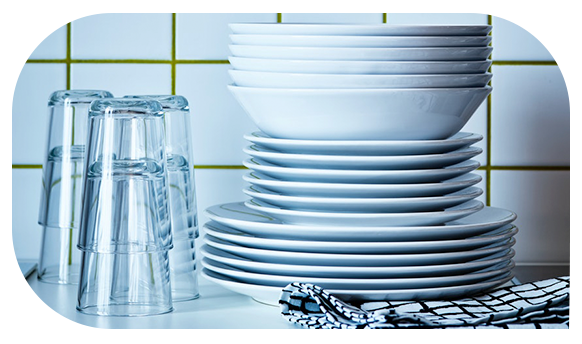
Where is `cups`? This screenshot has height=344, width=582. cups is located at coordinates pyautogui.click(x=69, y=266), pyautogui.click(x=66, y=194), pyautogui.click(x=125, y=195), pyautogui.click(x=125, y=291), pyautogui.click(x=190, y=262), pyautogui.click(x=182, y=192).